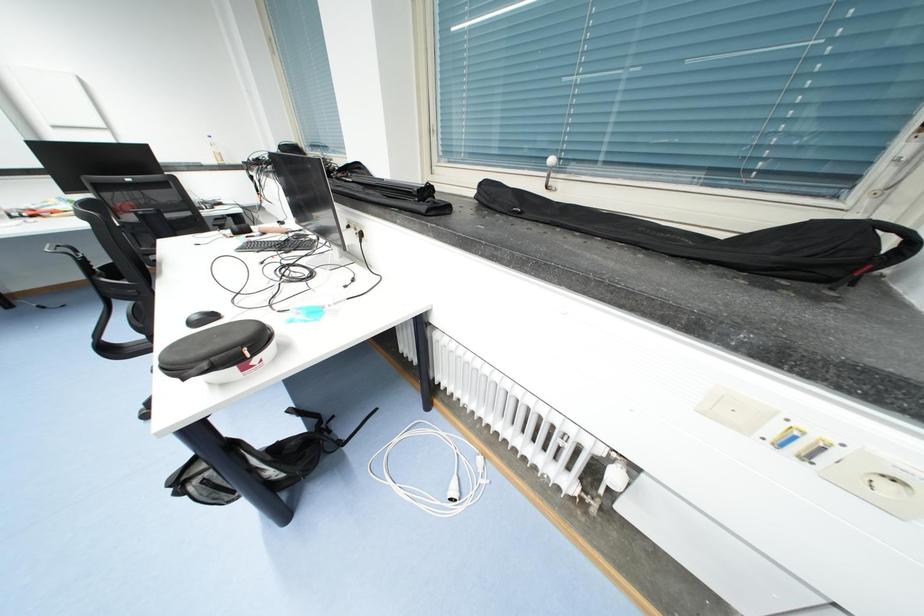
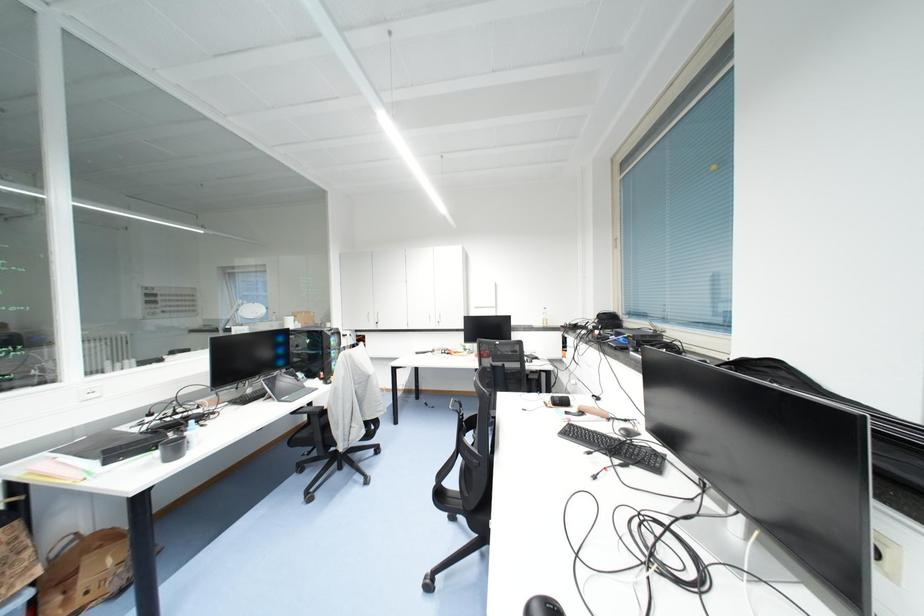
Based on the continuous images, in which direction is the camera rotating?

The camera's rotation is toward left-up.